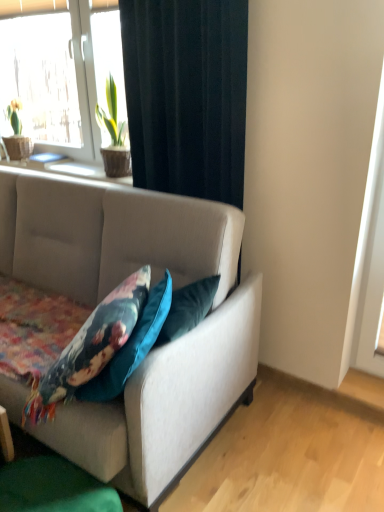
Question: From the image's perspective, relative to white plastic window at upper left, is black fabric curtain at upper center above or below?

Choices:
 (A) above
 (B) below

Answer: (B)

Question: In terms of height, does black fabric curtain at upper center look taller or shorter compared to white plastic window at upper left?

Choices:
 (A) short
 (B) tall

Answer: (B)

Question: Estimate the real-world distances between objects in this image. Which object is closer to the textured beige studio couch at center?

Choices:
 (A) floral fabric cushion at lower left
 (B) smooth wooden window sill at upper left
 (C) white plastic window at upper left
 (D) black fabric curtain at upper center

Answer: (A)

Question: Which object is positioned farthest from the smooth wooden window sill at upper left?

Choices:
 (A) white plastic window at upper left
 (B) textured beige studio couch at center
 (C) floral fabric cushion at lower left
 (D) black fabric curtain at upper center

Answer: (C)